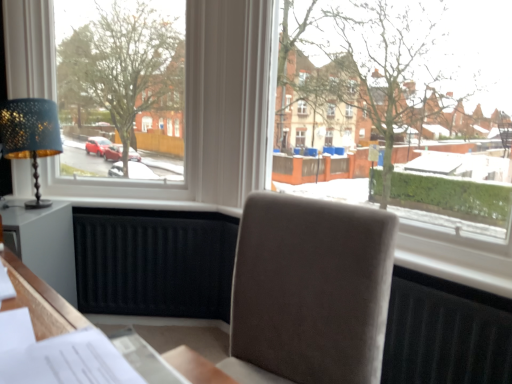
Question: Based on their sizes in the image, would you say white plastic window at upper left, the 2th window positioned from the right, is bigger or smaller than transparent glass window at center, acting as the 2th window starting from the left?

Choices:
 (A) small
 (B) big

Answer: (A)

Question: Considering the positions of white plastic window at upper left, which is counted as the first window, starting from the left, and transparent glass window at center, placed as the 1th window when sorted from right to left, in the image, is white plastic window at upper left, which is counted as the first window, starting from the left, taller or shorter than transparent glass window at center, placed as the 1th window when sorted from right to left,?

Choices:
 (A) tall
 (B) short

Answer: (A)

Question: Which of these objects is positioned closest to the white plastic window at upper left, which is counted as the first window, starting from the left?

Choices:
 (A) matte gold table lamp at left
 (B) transparent glass window at center, placed as the 1th window when sorted from right to left
 (C) suede-like beige chair at center
 (D) white wood table at lower left
 (E) white paper at lower left

Answer: (A)

Question: Estimate the real-world distances between objects in this image. Which object is farther from the transparent glass window at center, placed as the 1th window when sorted from right to left?

Choices:
 (A) suede-like beige chair at center
 (B) white plastic window at upper left, the 2th window positioned from the right
 (C) white paper at lower left
 (D) matte gold table lamp at left
 (E) white wood table at lower left

Answer: (C)